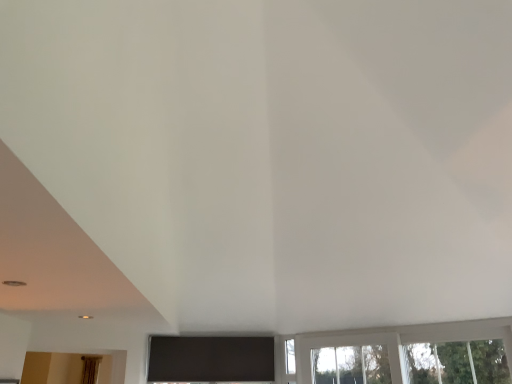
Question: Is point (297, 372) closer or farther from the camera than point (92, 365)?

Choices:
 (A) farther
 (B) closer

Answer: (A)

Question: In terms of height, does transparent glass window at lower right look taller or shorter compared to brown fabric curtain at lower left?

Choices:
 (A) tall
 (B) short

Answer: (B)

Question: Is transparent glass window at lower right in front of or behind brown fabric curtain at lower left in the image?

Choices:
 (A) front
 (B) behind

Answer: (A)

Question: Would you say brown fabric curtain at lower left is to the left or to the right of transparent glass window at lower right in the picture?

Choices:
 (A) right
 (B) left

Answer: (B)

Question: Considering the positions of brown fabric curtain at lower left and transparent glass window at lower right in the image, is brown fabric curtain at lower left bigger or smaller than transparent glass window at lower right?

Choices:
 (A) big
 (B) small

Answer: (B)

Question: Considering the positions of point (83, 380) and point (421, 326), is point (83, 380) closer or farther from the camera than point (421, 326)?

Choices:
 (A) farther
 (B) closer

Answer: (A)

Question: From the image's perspective, is brown fabric curtain at lower left positioned above or below transparent glass window at lower right?

Choices:
 (A) above
 (B) below

Answer: (B)